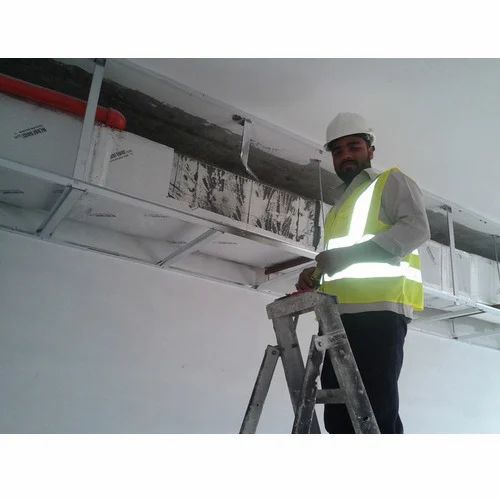
Locate an element on the screen. white ceiling is located at coordinates (363, 87).